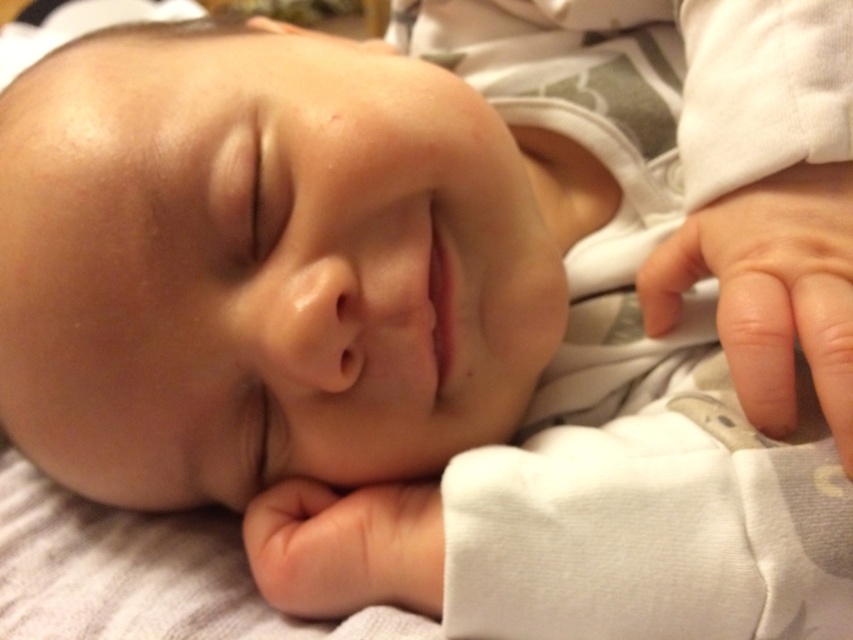
Question: Which object appears farthest from the camera in this image?

Choices:
 (A) smooth skin hand at lower center
 (B) smooth skin hand at lower right

Answer: (A)

Question: Can you confirm if smooth skin hand at lower right is positioned to the right of smooth skin hand at lower center?

Choices:
 (A) no
 (B) yes

Answer: (B)

Question: Which point is farther to the camera?

Choices:
 (A) 288,492
 (B) 694,225

Answer: (A)

Question: Is smooth skin hand at lower right above smooth skin hand at lower center?

Choices:
 (A) yes
 (B) no

Answer: (A)

Question: In this image, where is smooth skin hand at lower right located relative to smooth skin hand at lower center?

Choices:
 (A) right
 (B) left

Answer: (A)

Question: Which point is closer to the camera taking this photo?

Choices:
 (A) (740, 268)
 (B) (318, 566)

Answer: (A)